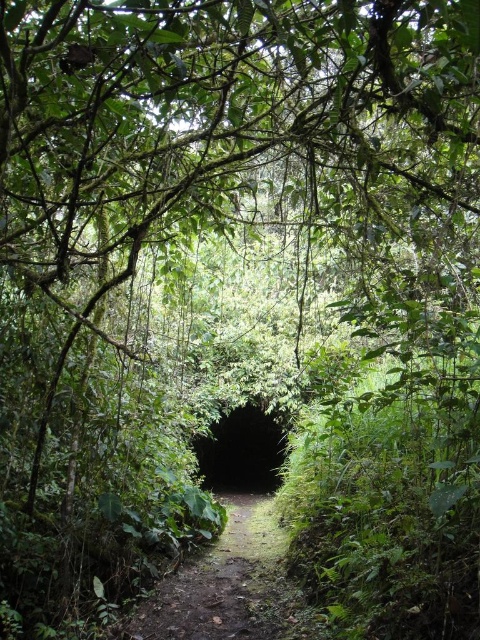
Question: Can you confirm if dirt path at center is positioned to the right of black matte tunnel at center?

Choices:
 (A) yes
 (B) no

Answer: (A)

Question: Does dirt path at center appear on the left side of black matte tunnel at center?

Choices:
 (A) no
 (B) yes

Answer: (A)

Question: Which point is closer to the camera?

Choices:
 (A) black matte tunnel at center
 (B) dirt path at center

Answer: (B)

Question: Can you confirm if dirt path at center is positioned above black matte tunnel at center?

Choices:
 (A) no
 (B) yes

Answer: (B)